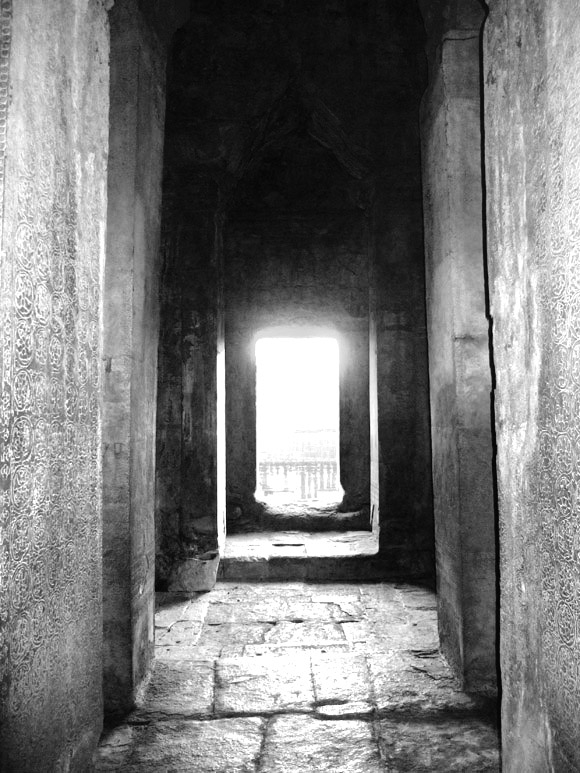
Identify the location of wall around door. The width and height of the screenshot is (580, 773). (248, 448), (295, 305), (358, 379), (307, 522).